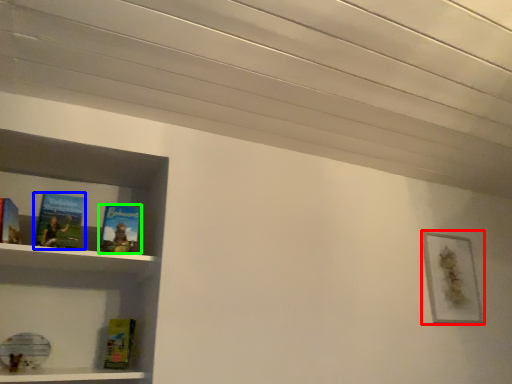
Question: Based on their relative distances, which object is nearer to picture frame (highlighted by a red box)? Choose from book (highlighted by a blue box) and book (highlighted by a green box).

Choices:
 (A) book
 (B) book

Answer: (B)